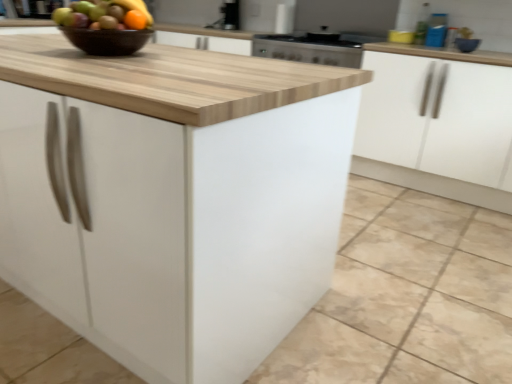
Question: Based on their sizes in the image, would you say white matte cabinet at center, the second cabinetry positioned from the back, is bigger or smaller than white matte cabinet at right, positioned as the 2th cabinetry in front-to-back order?

Choices:
 (A) big
 (B) small

Answer: (A)

Question: In terms of height, does white matte cabinet at center, which is counted as the 1th cabinetry, starting from the front, look taller or shorter compared to white matte cabinet at right, placed as the first cabinetry when sorted from back to front?

Choices:
 (A) short
 (B) tall

Answer: (A)

Question: Which is nearer to the white matte cabinet at center, the second cabinetry positioned from the back?

Choices:
 (A) brown glossy bowl at upper center
 (B) blue glossy bowl at upper right
 (C) stainless steel oven at upper center
 (D) satin silver sink at upper center
 (E) orange matte grapefruit at upper left

Answer: (A)

Question: Based on their relative distances, which object is farther from the white matte cabinet at center, which is counted as the 1th cabinetry, starting from the front?

Choices:
 (A) blue glossy bowl at upper right
 (B) brown glossy bowl at upper center
 (C) white matte cabinet at right, positioned as the 2th cabinetry in front-to-back order
 (D) orange matte grapefruit at upper left
 (E) satin silver sink at upper center

Answer: (E)